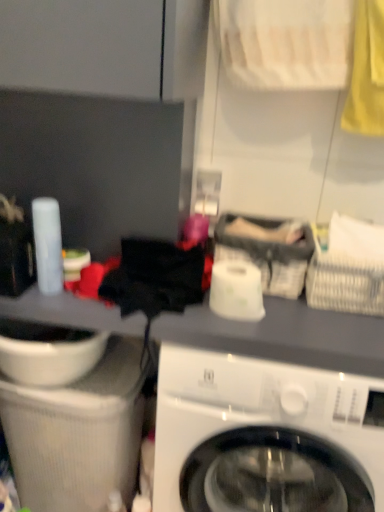
Question: Is white glossy toilet paper at center taller than gray fabric basket at center, which ranks as the 1th basket in left-to-right order?

Choices:
 (A) yes
 (B) no

Answer: (B)

Question: Considering the relative sizes of white glossy toilet paper at center and gray fabric basket at center, the second basket when ordered from right to left, in the image provided, is white glossy toilet paper at center thinner than gray fabric basket at center, the second basket when ordered from right to left,?

Choices:
 (A) no
 (B) yes

Answer: (B)

Question: From a real-world perspective, is white glossy toilet paper at center physically above gray fabric basket at center, the second basket when ordered from right to left?

Choices:
 (A) no
 (B) yes

Answer: (A)

Question: Considering the relative positions of white glossy toilet paper at center and gray fabric basket at center, the second basket when ordered from right to left, in the image provided, is white glossy toilet paper at center to the right of gray fabric basket at center, the second basket when ordered from right to left, from the viewer's perspective?

Choices:
 (A) no
 (B) yes

Answer: (A)

Question: Is white glossy toilet paper at center shorter than gray fabric basket at center, the second basket when ordered from right to left?

Choices:
 (A) yes
 (B) no

Answer: (A)

Question: Is white glossy toilet paper at center further to camera compared to gray fabric basket at center, which ranks as the 1th basket in left-to-right order?

Choices:
 (A) no
 (B) yes

Answer: (A)

Question: From the image's perspective, is white glossy toilet paper at center on top of white woven basket at upper right, which is the first basket in right-to-left order?

Choices:
 (A) yes
 (B) no

Answer: (B)

Question: Is the position of white glossy toilet paper at center more distant than that of white woven basket at upper right, the 2th basket from the left?

Choices:
 (A) no
 (B) yes

Answer: (A)

Question: Can you confirm if white glossy toilet paper at center is taller than white woven basket at upper right, the 2th basket from the left?

Choices:
 (A) no
 (B) yes

Answer: (A)

Question: Is white woven basket at upper right, the 2th basket from the left, a part of white glossy toilet paper at center?

Choices:
 (A) no
 (B) yes

Answer: (A)

Question: Is white glossy toilet paper at center outside white woven basket at upper right, the 2th basket from the left?

Choices:
 (A) yes
 (B) no

Answer: (A)

Question: Is white glossy toilet paper at center positioned with its back to white woven basket at upper right, the 2th basket from the left?

Choices:
 (A) no
 (B) yes

Answer: (A)

Question: From the image's perspective, is white glossy washing machine at center located above white woven basket at upper right, the 2th basket from the left?

Choices:
 (A) no
 (B) yes

Answer: (A)